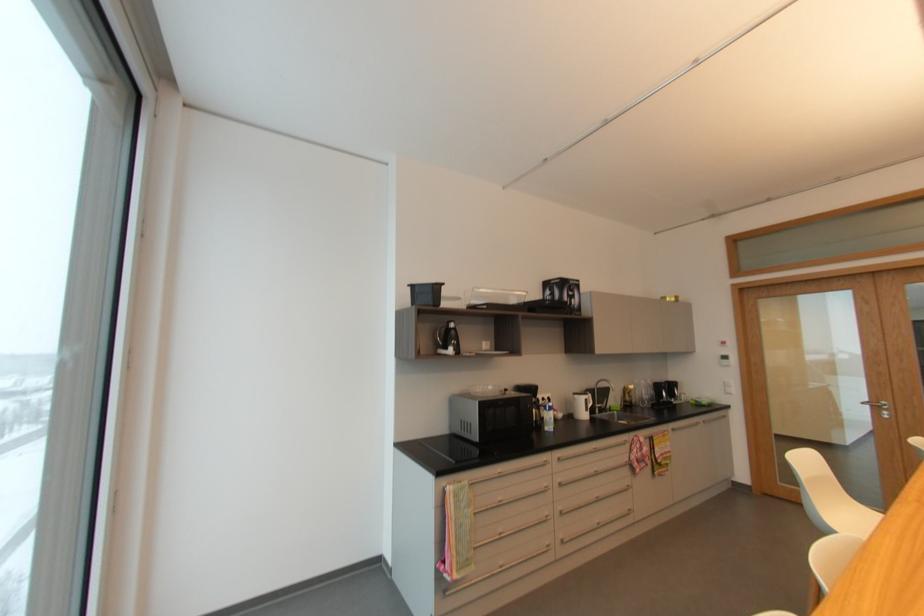
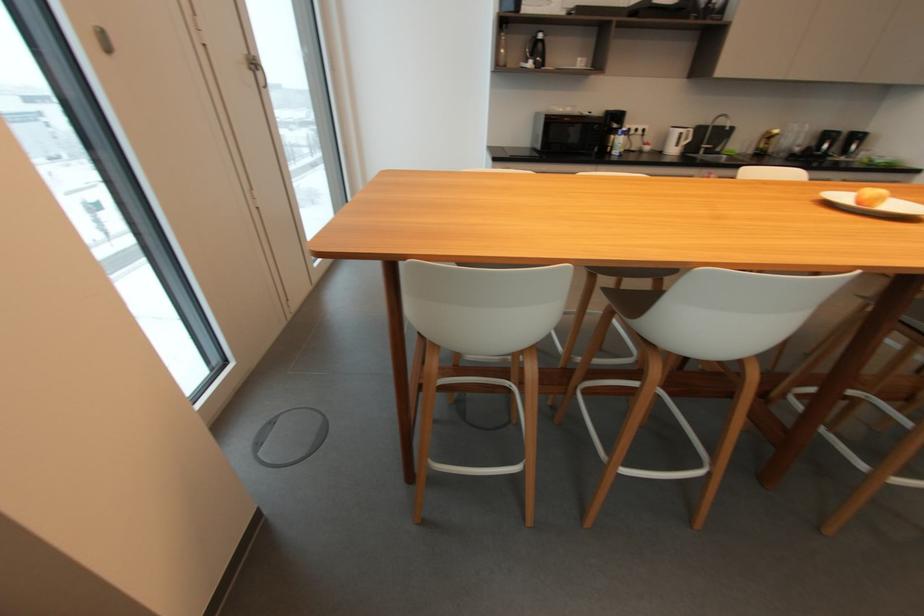
Locate, in the second image, the point that corresponds to pixel 590 400 in the first image.

(685, 134)